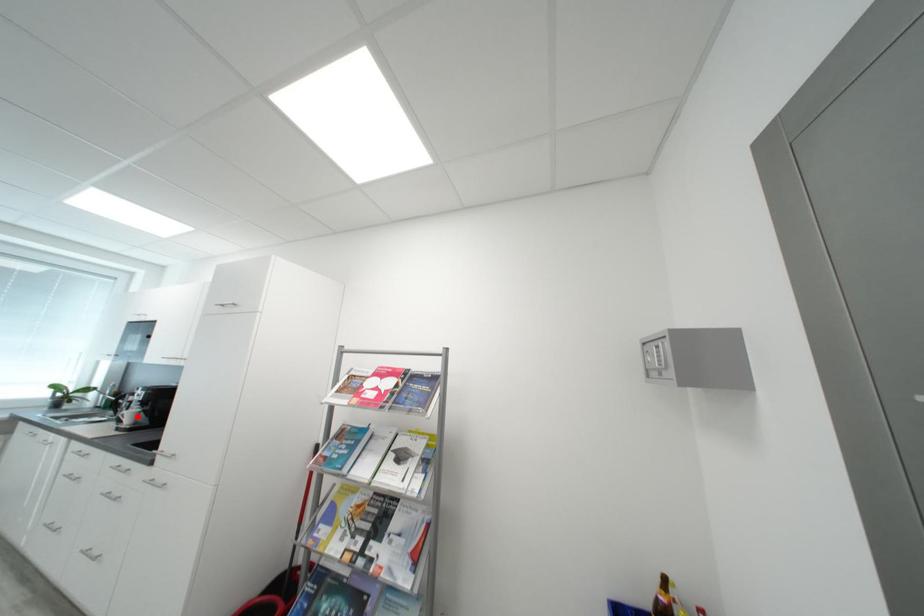
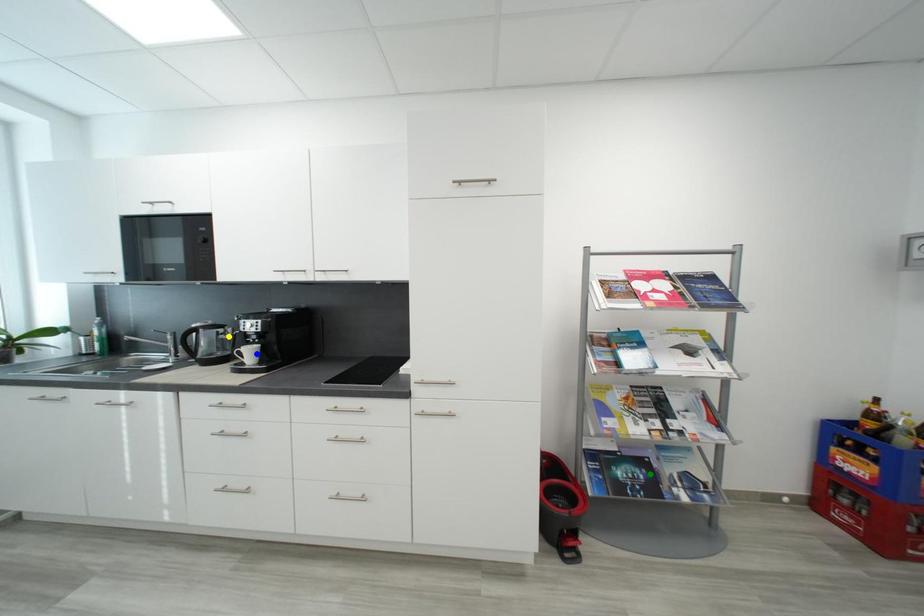
Question: I am providing you with two images of the same scene from different viewpoints. A red point is marked on the first image. You are given multiple points on the second image. Can you choose the point in image 2 that corresponds to the point in image 1?

Choices:
 (A) green point
 (B) blue point
 (C) yellow point

Answer: (B)